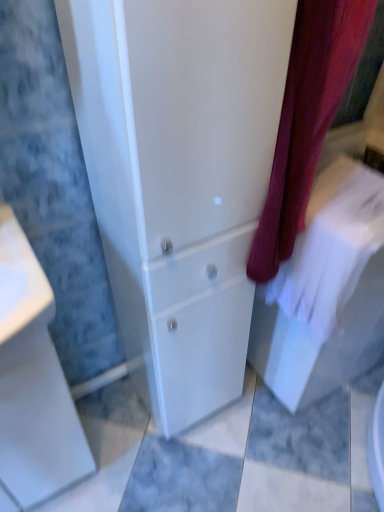
What do you see at coordinates (33, 381) in the screenshot? This screenshot has height=512, width=384. I see `white glossy porcelain at lower left` at bounding box center [33, 381].

Identify the location of velvet burgundy curtain at center. click(x=307, y=119).

The image size is (384, 512). What are the coordinates of `white glossy cabinet at center` in the screenshot? It's located at (179, 176).

The image size is (384, 512). I want to click on white glossy porcelain at lower left, so click(x=33, y=381).

In the image, is white cotton bath towel at right on the left side or the right side of white glossy cabinet at center?

Clearly, white cotton bath towel at right is on the right of white glossy cabinet at center in the image.

Which of these two, white cotton bath towel at right or white glossy cabinet at center, is thinner?

Thinner between the two is white cotton bath towel at right.

From a real-world perspective, is white cotton bath towel at right below white glossy cabinet at center?

No.

Is white cotton bath towel at right facing towards white glossy cabinet at center?

No, white cotton bath towel at right is not aimed at white glossy cabinet at center.

This screenshot has height=512, width=384. In order to click on porcelain lying behind the velvet burgundy curtain at center in this screenshot , I will do pyautogui.click(x=33, y=381).

Who is taller, white glossy porcelain at lower left or velvet burgundy curtain at center?

white glossy porcelain at lower left is taller.

From a real-world perspective, who is located lower, white glossy porcelain at lower left or velvet burgundy curtain at center?

white glossy porcelain at lower left.

Considering the sizes of objects white glossy porcelain at lower left and velvet burgundy curtain at center in the image provided, who is wider, white glossy porcelain at lower left or velvet burgundy curtain at center?

velvet burgundy curtain at center.

Is white glossy cabinet at center oriented away from velvet burgundy curtain at center?

No, white glossy cabinet at center is not facing away from velvet burgundy curtain at center.

Is white glossy cabinet at center in front of or behind velvet burgundy curtain at center in the image?

white glossy cabinet at center is in front of velvet burgundy curtain at center.

Considering the points (287, 64) and (288, 170), which point is behind, point (287, 64) or point (288, 170)?

The point (288, 170) is behind.

Between white glossy cabinet at center and velvet burgundy curtain at center, which one appears on the left side from the viewer's perspective?

white glossy cabinet at center.

Looking at this image, is white cotton bath towel at right behind velvet burgundy curtain at center?

Yes, white cotton bath towel at right is further from the viewer.

Is point (293, 259) positioned before point (314, 137)?

No, (293, 259) is behind (314, 137).

Would you say white cotton bath towel at right is a long distance from velvet burgundy curtain at center?

No.

Can you confirm if white cotton bath towel at right is thinner than velvet burgundy curtain at center?

Yes, white cotton bath towel at right is thinner than velvet burgundy curtain at center.

From a real-world perspective, is white glossy cabinet at center above or below white cotton bath towel at right?

Clearly, from a real-world perspective, white glossy cabinet at center is below white cotton bath towel at right.

Consider the image. Is white glossy cabinet at center taller than white cotton bath towel at right?

Indeed, white glossy cabinet at center has a greater height compared to white cotton bath towel at right.

Choose the correct answer: Is white glossy cabinet at center inside white cotton bath towel at right or outside it?

The correct answer is: outside.

Does white glossy porcelain at lower left turn towards white cotton bath towel at right?

No, white glossy porcelain at lower left is not facing towards white cotton bath towel at right.

Considering the positions of objects white glossy porcelain at lower left and white cotton bath towel at right in the image provided, who is more to the left, white glossy porcelain at lower left or white cotton bath towel at right?

white glossy porcelain at lower left is more to the left.

Considering the sizes of white glossy porcelain at lower left and white cotton bath towel at right in the image, is white glossy porcelain at lower left bigger or smaller than white cotton bath towel at right?

In the image, white glossy porcelain at lower left appears to be larger than white cotton bath towel at right.

Is velvet burgundy curtain at center wider than white cotton bath towel at right?

Yes, velvet burgundy curtain at center is wider than white cotton bath towel at right.

Considering the positions of points (295, 44) and (371, 208), is point (295, 44) closer to camera compared to point (371, 208)?

That is True.

Considering the relative sizes of velvet burgundy curtain at center and white cotton bath towel at right in the image provided, is velvet burgundy curtain at center taller than white cotton bath towel at right?

Yes, velvet burgundy curtain at center is taller than white cotton bath towel at right.

You are a GUI agent. You are given a task and a screenshot of the screen. Output one action in this format:
    pyautogui.click(x=<x>, y=<y>)
    Task: Click on the bathroom cabinet in front of the white cotton bath towel at right
    This screenshot has height=512, width=384.
    Given the screenshot: What is the action you would take?
    pyautogui.click(x=179, y=176)

Locate an element on the screen. This screenshot has width=384, height=512. curtain above the white glossy porcelain at lower left (from a real-world perspective) is located at coordinates (307, 119).

When comparing their distances from white glossy porcelain at lower left, does white cotton bath towel at right or white glossy cabinet at center seem further?

white cotton bath towel at right is further to white glossy porcelain at lower left.

When comparing their distances from white glossy porcelain at lower left, does white glossy cabinet at center or velvet burgundy curtain at center seem further?

velvet burgundy curtain at center is further to white glossy porcelain at lower left.

Which object lies nearer to the anchor point white glossy porcelain at lower left, velvet burgundy curtain at center or white glossy cabinet at center?

white glossy cabinet at center.

Looking at this image, from the image, which object appears to be farther from white glossy cabinet at center, white cotton bath towel at right or velvet burgundy curtain at center?

white cotton bath towel at right lies further to white glossy cabinet at center than the other object.

Estimate the real-world distances between objects in this image. Which object is further from velvet burgundy curtain at center, white cotton bath towel at right or white glossy cabinet at center?

white glossy cabinet at center is further to velvet burgundy curtain at center.

Estimate the real-world distances between objects in this image. Which object is further from white cotton bath towel at right, white glossy cabinet at center or white glossy porcelain at lower left?

The object further to white cotton bath towel at right is white glossy porcelain at lower left.

Which object lies nearer to the anchor point white glossy porcelain at lower left, white cotton bath towel at right or velvet burgundy curtain at center?

Among the two, velvet burgundy curtain at center is located nearer to white glossy porcelain at lower left.

Based on their spatial positions, is white glossy porcelain at lower left or white glossy cabinet at center closer to velvet burgundy curtain at center?

white glossy cabinet at center is positioned closer to the anchor velvet burgundy curtain at center.

Find the location of a particular element. The height and width of the screenshot is (512, 384). bathroom cabinet situated between white glossy porcelain at lower left and white cotton bath towel at right from left to right is located at coordinates (179, 176).

Find the location of `curtain between white glossy cabinet at center and white cotton bath towel at right`. curtain between white glossy cabinet at center and white cotton bath towel at right is located at coordinates (307, 119).

Image resolution: width=384 pixels, height=512 pixels. In order to click on bathroom cabinet located between white glossy porcelain at lower left and velvet burgundy curtain at center in the left-right direction in this screenshot , I will do `click(179, 176)`.

You are a GUI agent. You are given a task and a screenshot of the screen. Output one action in this format:
    pyautogui.click(x=<x>, y=<y>)
    Task: Click on the curtain between white glossy porcelain at lower left and white cotton bath towel at right in the horizontal direction
    
    Given the screenshot: What is the action you would take?
    pyautogui.click(x=307, y=119)